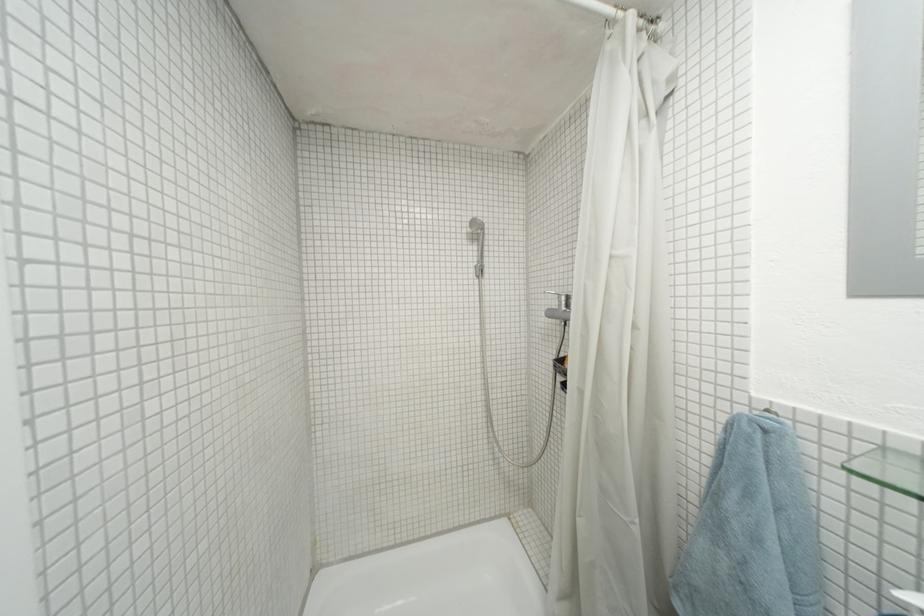
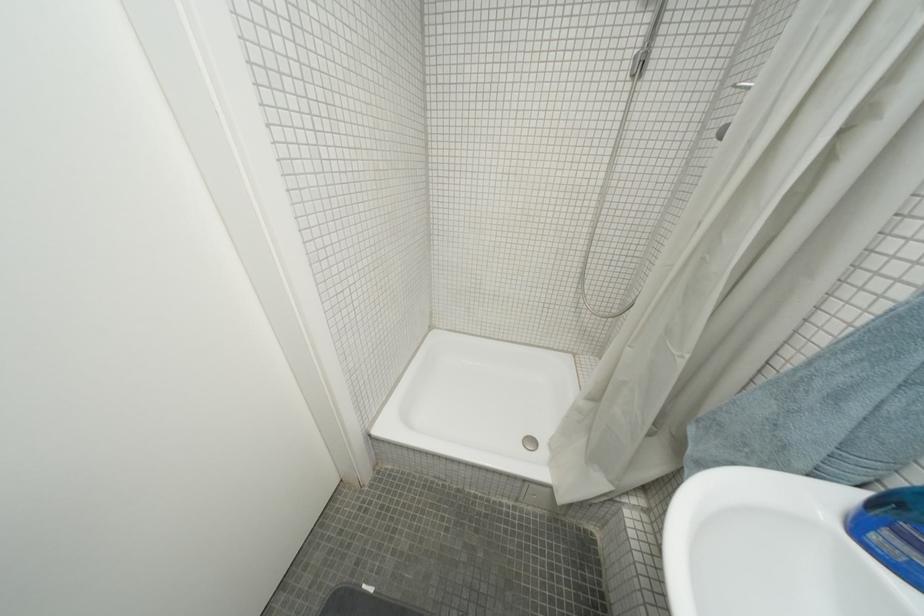
In the second image, find the point that corresponds to pixel 647 523 in the first image.

(697, 359)